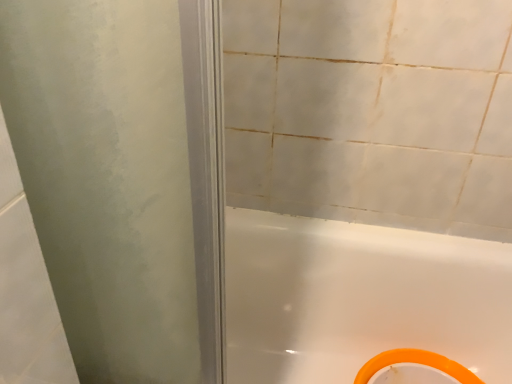
Question: Is white glossy bathtub at lower right positioned with its back to orange rubber ring at bottom right?

Choices:
 (A) yes
 (B) no

Answer: (A)

Question: Considering the relative sizes of white glossy bathtub at lower right and orange rubber ring at bottom right in the image provided, is white glossy bathtub at lower right bigger than orange rubber ring at bottom right?

Choices:
 (A) yes
 (B) no

Answer: (A)

Question: Is white glossy bathtub at lower right positioned far away from orange rubber ring at bottom right?

Choices:
 (A) yes
 (B) no

Answer: (B)

Question: Is white glossy bathtub at lower right positioned in front of orange rubber ring at bottom right?

Choices:
 (A) yes
 (B) no

Answer: (A)

Question: Considering the relative sizes of white glossy bathtub at lower right and orange rubber ring at bottom right in the image provided, is white glossy bathtub at lower right smaller than orange rubber ring at bottom right?

Choices:
 (A) no
 (B) yes

Answer: (A)

Question: Does white glossy bathtub at lower right have a greater height compared to orange rubber ring at bottom right?

Choices:
 (A) yes
 (B) no

Answer: (A)

Question: Can you confirm if orange rubber ring at bottom right is wider than white glossy bathtub at lower right?

Choices:
 (A) no
 (B) yes

Answer: (A)

Question: Considering the relative positions of orange rubber ring at bottom right and white glossy bathtub at lower right in the image provided, is orange rubber ring at bottom right to the left of white glossy bathtub at lower right from the viewer's perspective?

Choices:
 (A) no
 (B) yes

Answer: (A)

Question: Would you consider orange rubber ring at bottom right to be distant from white glossy bathtub at lower right?

Choices:
 (A) yes
 (B) no

Answer: (B)

Question: Is orange rubber ring at bottom right outside of white glossy bathtub at lower right?

Choices:
 (A) no
 (B) yes

Answer: (A)

Question: Is orange rubber ring at bottom right closer to camera compared to white glossy bathtub at lower right?

Choices:
 (A) no
 (B) yes

Answer: (A)

Question: Is orange rubber ring at bottom right looking in the opposite direction of white glossy bathtub at lower right?

Choices:
 (A) no
 (B) yes

Answer: (B)

Question: Considering their positions, is white glossy bathtub at lower right located in front of or behind orange rubber ring at bottom right?

Choices:
 (A) behind
 (B) front

Answer: (B)